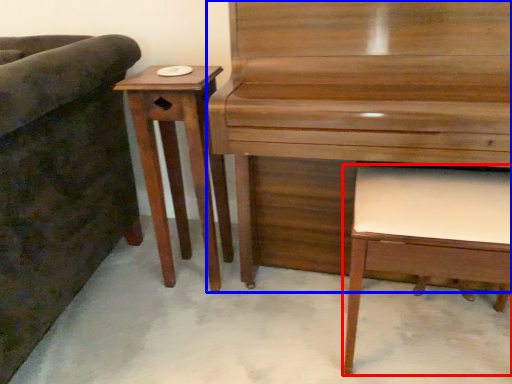
Question: Which object is closer to the camera taking this photo, music stool (highlighted by a red box) or piano (highlighted by a blue box)?

Choices:
 (A) music stool
 (B) piano

Answer: (B)